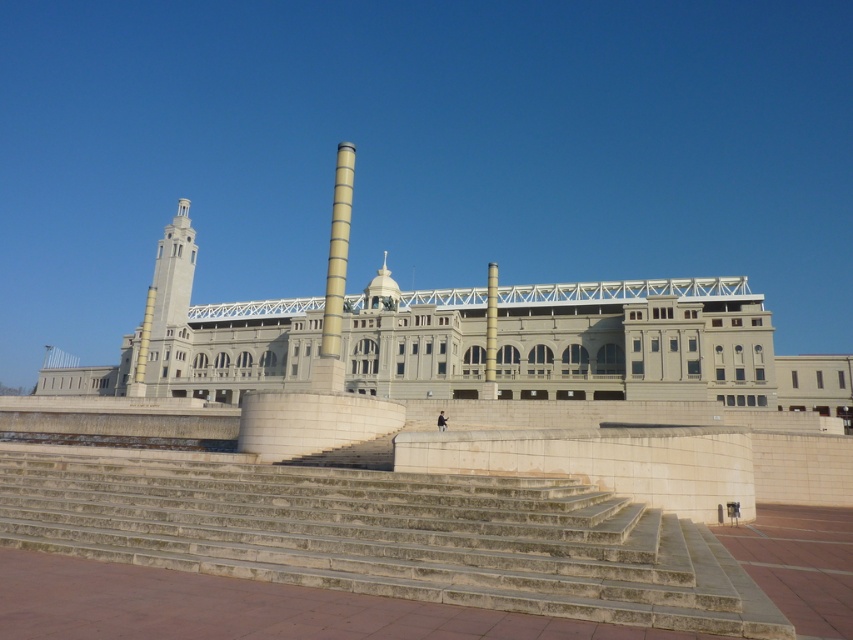
Is stone steps at center wider than yellow concrete pillar at center?

Correct, the width of stone steps at center exceeds that of yellow concrete pillar at center.

Who is more forward, (506,570) or (339,198)?

Point (506,570) is more forward.

The image size is (853, 640). What are the coordinates of `stone steps at center` in the screenshot? It's located at (390, 536).

Between stone steps at center and gray stone building at center, which one appears on the right side from the viewer's perspective?

Positioned to the right is stone steps at center.

Can you confirm if stone steps at center is positioned to the left of gray stone building at center?

Incorrect, stone steps at center is not on the left side of gray stone building at center.

In order to click on stone steps at center in this screenshot , I will do `click(390, 536)`.

Does gray stone building at center appear over yellow concrete pillar at center?

No, gray stone building at center is not above yellow concrete pillar at center.

Is gray stone building at center below yellow concrete pillar at center?

Yes.

Which is in front, point (426, 340) or point (344, 156)?

Positioned in front is point (344, 156).

Find the location of a particular element. gray stone building at center is located at coordinates (657, 346).